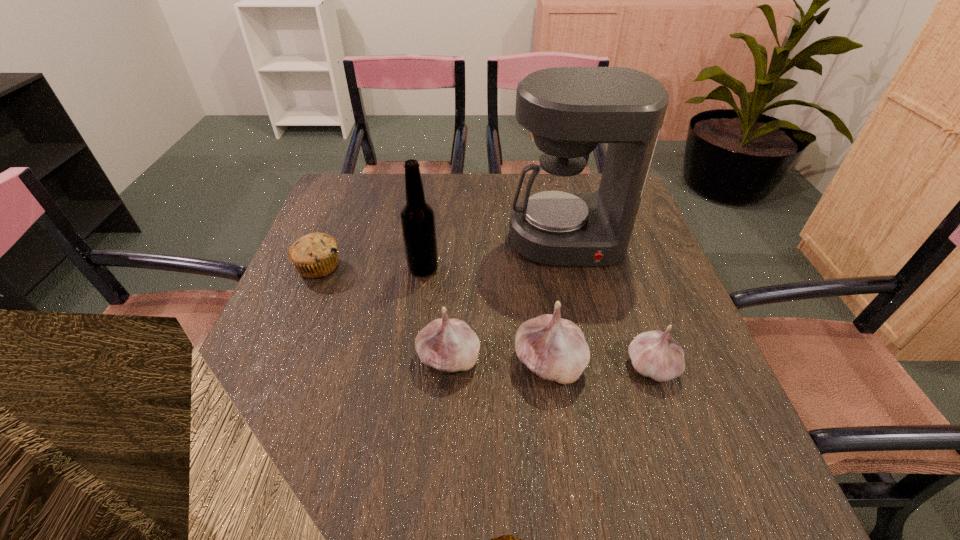
All garlics are currently evenly spaced. To continue this pattern, where would you add another garlic on the left? Please point out a vacant spot. Please provide its 2D coordinates. Your answer should be formatted as a tuple, i.e. [(x, y)], where the tuple contains the x and y coordinates of a point satisfying the conditions above.

[(348, 355)]